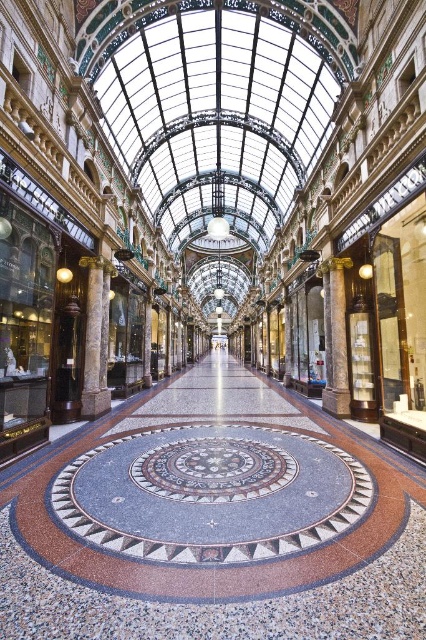
You are standing in the shopping arcade and want to take a photo of the marble column at left and the marble column at center. If you stand directly under the glass ceiling panels, will both columns be visible in your photo?

The marble column at left is positioned under the marble column at center, so if you stand directly under the glass ceiling panels, the marble column at center may block the view of the marble column at left in your photo.

You are a delivery person carrying a large package that is 2 meters wide. You need to navigate through the grand shopping arcade. Can you pass between the marble mosaic floor at center and the marble column at center without tilting the package?

The marble mosaic floor at center is wider than the marble column at center, so the 2 meters wide package can pass through the space between them without tilting.